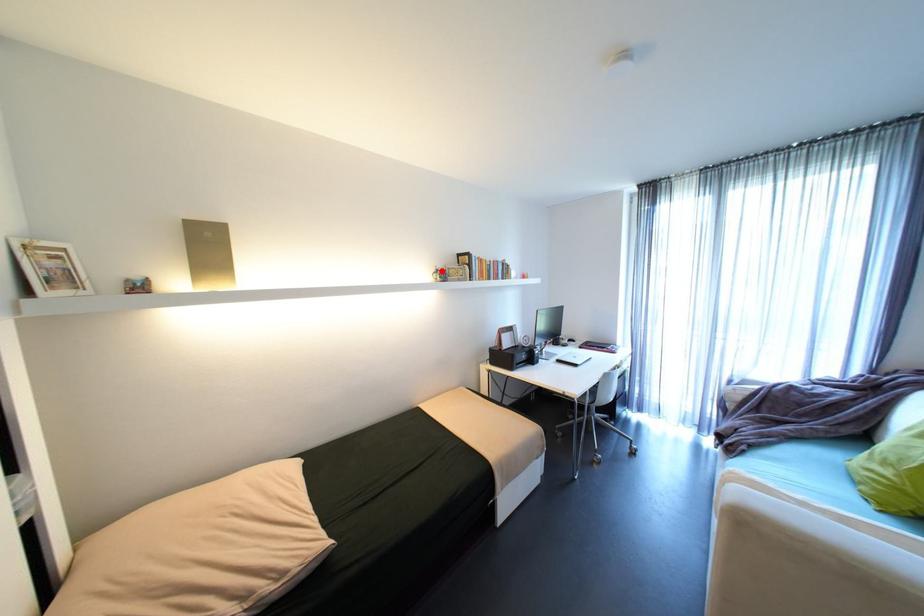
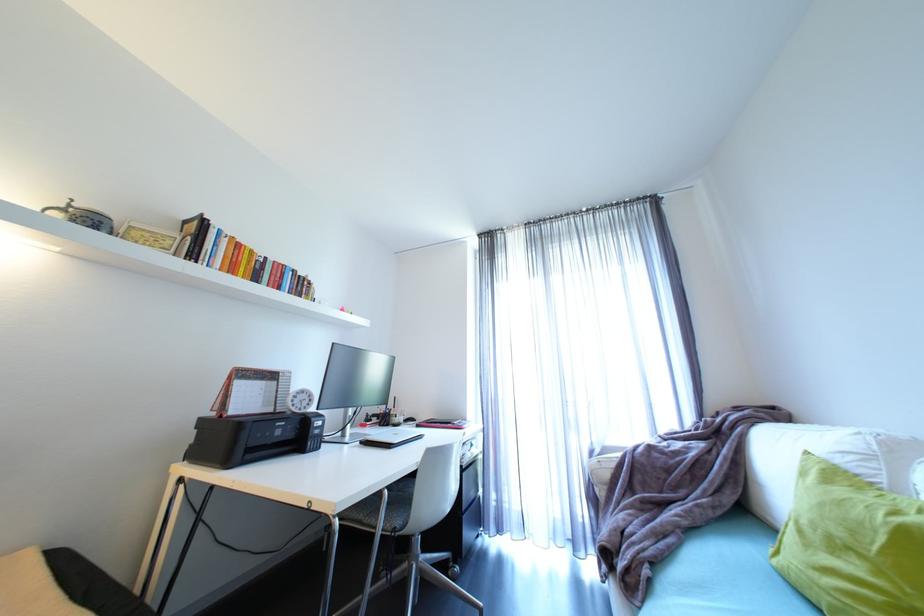
Find the pixel in the second image that matches the highlighted location in the first image.

(69, 206)